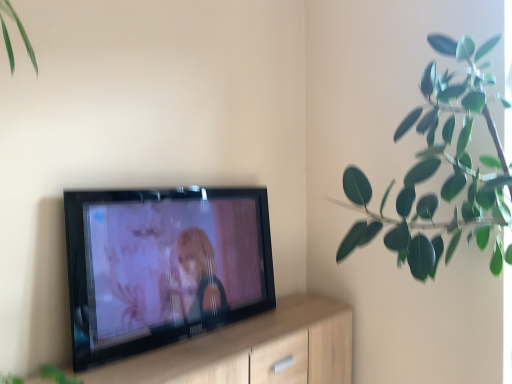
What do you see at coordinates (252, 350) in the screenshot?
I see `light wood dresser at center` at bounding box center [252, 350].

The image size is (512, 384). In order to click on light wood dresser at center in this screenshot , I will do `click(252, 350)`.

Measure the distance between point (162, 363) and camera.

Point (162, 363) is 5.33 feet away from camera.

What is the approximate width of green rubber plant at upper right?

green rubber plant at upper right is 25.37 inches in width.

Locate an element on the screen. The image size is (512, 384). green rubber plant at upper right is located at coordinates (438, 167).

The image size is (512, 384). What do you see at coordinates (438, 167) in the screenshot?
I see `green rubber plant at upper right` at bounding box center [438, 167].

You are a GUI agent. You are given a task and a screenshot of the screen. Output one action in this format:
    pyautogui.click(x=<x>, y=<y>)
    Task: Click on the light wood dresser at center
    Image resolution: width=512 pixels, height=384 pixels.
    Given the screenshot: What is the action you would take?
    pyautogui.click(x=252, y=350)

Is light wood dresser at center at the right side of green rubber plant at upper right?

In fact, light wood dresser at center is to the left of green rubber plant at upper right.

Is the depth of light wood dresser at center greater than that of green rubber plant at upper right?

No, light wood dresser at center is closer to the camera.

Is point (183, 363) closer or farther from the camera than point (415, 177)?

Point (183, 363) appears to be closer to the viewer than point (415, 177).

From the image's perspective, is light wood dresser at center above green rubber plant at upper right?

No, from the image's perspective, light wood dresser at center is not above green rubber plant at upper right.

From a real-world perspective, is light wood dresser at center on top of green rubber plant at upper right?

Incorrect, from a real-world perspective, light wood dresser at center is lower than green rubber plant at upper right.

Does light wood dresser at center have a greater width compared to green rubber plant at upper right?

No, light wood dresser at center is not wider than green rubber plant at upper right.

Between light wood dresser at center and green rubber plant at upper right, which one has more height?

Standing taller between the two is green rubber plant at upper right.

Considering the sizes of light wood dresser at center and green rubber plant at upper right in the image, is light wood dresser at center bigger or smaller than green rubber plant at upper right?

Considering their sizes, light wood dresser at center takes up less space than green rubber plant at upper right.

Is light wood dresser at center completely or partially outside of green rubber plant at upper right?

Absolutely, light wood dresser at center is external to green rubber plant at upper right.

Would you consider light wood dresser at center to be distant from green rubber plant at upper right?

No, there isn't a large distance between light wood dresser at center and green rubber plant at upper right.

Is green rubber plant at upper right at the back of light wood dresser at center?

That's not correct — light wood dresser at center is not looking away from green rubber plant at upper right.

Looking at this image, how far apart are light wood dresser at center and green rubber plant at upper right?

light wood dresser at center and green rubber plant at upper right are 82.74 centimeters apart from each other.

Where is `dresser lying on the left of green rubber plant at upper right`? Image resolution: width=512 pixels, height=384 pixels. dresser lying on the left of green rubber plant at upper right is located at coordinates (252, 350).

Which is more to the right, green rubber plant at upper right or light wood dresser at center?

Positioned to the right is green rubber plant at upper right.

Which object is more forward, green rubber plant at upper right or light wood dresser at center?

light wood dresser at center is more forward.

Is point (346, 177) closer to viewer compared to point (238, 349)?

No, (346, 177) is further to viewer.

From the image's perspective, does green rubber plant at upper right appear lower than light wood dresser at center?

Incorrect, from the image's perspective, green rubber plant at upper right is higher than light wood dresser at center.

From a real-world perspective, which object rests below the other?

From a 3D spatial view, light wood dresser at center is below.

Consider the image. Considering the sizes of objects green rubber plant at upper right and light wood dresser at center in the image provided, who is thinner, green rubber plant at upper right or light wood dresser at center?

Thinner between the two is light wood dresser at center.

Considering the sizes of green rubber plant at upper right and light wood dresser at center in the image, is green rubber plant at upper right taller or shorter than light wood dresser at center?

Clearly, green rubber plant at upper right is taller compared to light wood dresser at center.

Considering the sizes of green rubber plant at upper right and light wood dresser at center in the image, is green rubber plant at upper right bigger or smaller than light wood dresser at center?

Considering their sizes, green rubber plant at upper right takes up more space than light wood dresser at center.

Is green rubber plant at upper right not within light wood dresser at center?

Yes, green rubber plant at upper right is not within light wood dresser at center.

Are green rubber plant at upper right and light wood dresser at center located far from each other?

Actually, green rubber plant at upper right and light wood dresser at center are a little close together.

Is green rubber plant at upper right aimed at light wood dresser at center?

No, green rubber plant at upper right is not turned towards light wood dresser at center.

How different are the orientations of green rubber plant at upper right and light wood dresser at center in degrees?

91.2 degrees.

Measure the distance between green rubber plant at upper right and light wood dresser at center.

The distance of green rubber plant at upper right from light wood dresser at center is 82.74 centimeters.

Find the location of a particular element. The width and height of the screenshot is (512, 384). dresser below the green rubber plant at upper right (from a real-world perspective) is located at coordinates (252, 350).

Where is `dresser in front of the green rubber plant at upper right`? The width and height of the screenshot is (512, 384). dresser in front of the green rubber plant at upper right is located at coordinates (252, 350).

Locate an element on the screen. The image size is (512, 384). dresser on the left of green rubber plant at upper right is located at coordinates (252, 350).